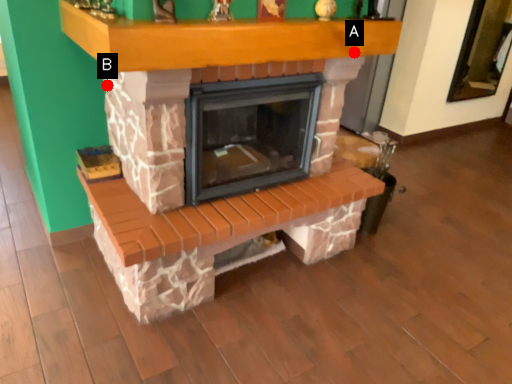
Question: Two points are circled on the image, labeled by A and B beside each circle. Which point is closer to the camera?

Choices:
 (A) A is closer
 (B) B is closer

Answer: (A)